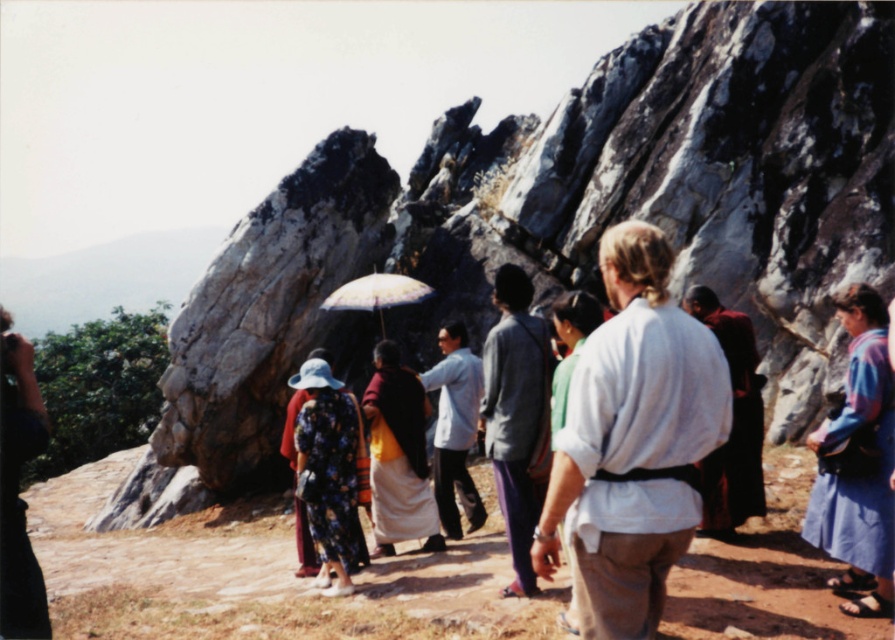
Question: Which point is closer to the camera?

Choices:
 (A) white paper umbrella at center
 (B) gray cotton shirt at center
 (C) white cotton shirt at center
 (D) yellow woolen robe at center

Answer: (C)

Question: Can you confirm if yellow woolen robe at center is bigger than white paper umbrella at center?

Choices:
 (A) no
 (B) yes

Answer: (A)

Question: Which of these objects is positioned farthest from the yellow woolen robe at center?

Choices:
 (A) white cotton shirt at center
 (B) light blue fabric shirt at center

Answer: (A)

Question: Can you confirm if light blue fabric shirt at center is positioned to the left of white paper umbrella at center?

Choices:
 (A) yes
 (B) no

Answer: (B)

Question: Which object is farther from the camera taking this photo?

Choices:
 (A) yellow woolen robe at center
 (B) maroon robe at center
 (C) white paper umbrella at center

Answer: (C)

Question: Does yellow woolen robe at center come behind maroon robe at center?

Choices:
 (A) yes
 (B) no

Answer: (A)